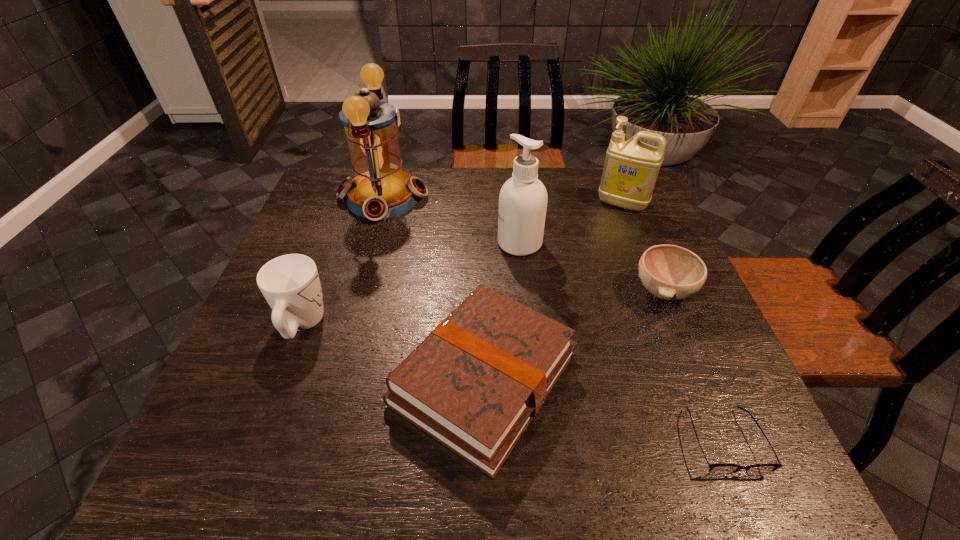
You are a GUI agent. You are given a task and a screenshot of the screen. Output one action in this format:
    pyautogui.click(x=<x>, y=<y>)
    Task: Click on the vacant space at the far edge of the desktop
    The image size is (960, 540).
    Given the screenshot: What is the action you would take?
    pyautogui.click(x=575, y=189)

Locate an element on the screen. The height and width of the screenshot is (540, 960). free location at the near edge of the desktop is located at coordinates (475, 476).

Locate an element on the screen. vacant region at the left edge of the desktop is located at coordinates (328, 274).

This screenshot has width=960, height=540. I want to click on free space at the right edge of the desktop, so click(x=632, y=262).

Where is `free spot at the far left corner of the desktop`? free spot at the far left corner of the desktop is located at coordinates (330, 205).

This screenshot has width=960, height=540. In order to click on free point between the fourth tallest object and the lantern in this screenshot , I will do `click(343, 261)`.

Locate an element on the screen. Image resolution: width=960 pixels, height=540 pixels. free space between the fourth shortest object and the third tallest object is located at coordinates (462, 264).

This screenshot has height=540, width=960. What are the coordinates of `free spot between the lantern and the sixth shortest object` in the screenshot? It's located at (451, 220).

At what (x,y) coordinates should I click in order to perform the action: click on empty location between the spectacles and the hardback book. Please return your answer as a coordinate pair (x, y). This screenshot has width=960, height=540. Looking at the image, I should click on (604, 409).

At what (x,y) coordinates should I click in order to perform the action: click on unoccupied position between the mug and the fifth nearest object. Please return your answer as a coordinate pair (x, y). The width and height of the screenshot is (960, 540). Looking at the image, I should click on (411, 284).